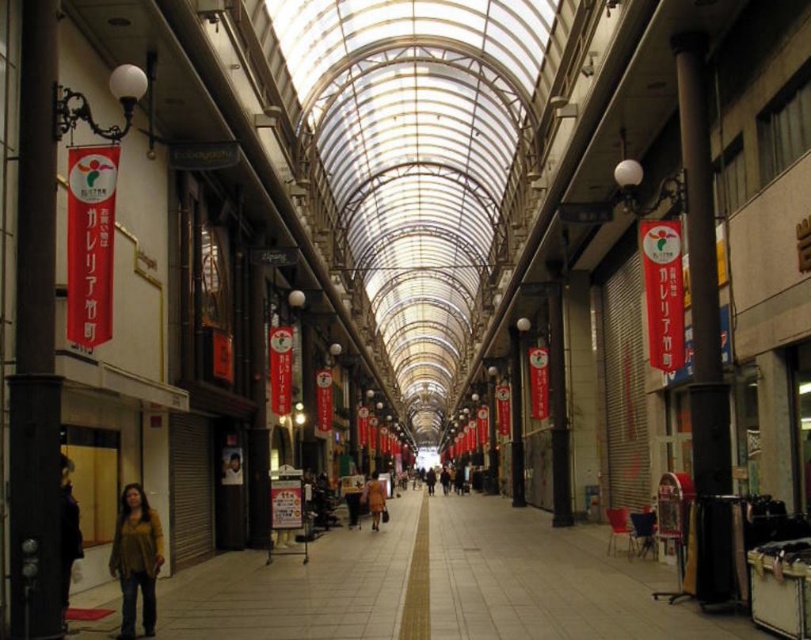
Question: Which of these objects is positioned farthest from the yellow knit sweater at lower left?

Choices:
 (A) dark brown leather jacket at lower left
 (B) black metal pole at right
 (C) orange fabric coat at center

Answer: (C)

Question: Is black metal pole at right to the right of orange fabric coat at center from the viewer's perspective?

Choices:
 (A) yes
 (B) no

Answer: (A)

Question: Observing the image, what is the correct spatial positioning of black metal pole at right in reference to dark brown leather jacket at lower left?

Choices:
 (A) above
 (B) below

Answer: (A)

Question: Is yellow knit sweater at lower left positioned in front of orange fabric coat at center?

Choices:
 (A) yes
 (B) no

Answer: (A)

Question: Among these points, which one is nearest to the camera?

Choices:
 (A) (375, 500)
 (B) (694, 99)
 (C) (71, 520)

Answer: (C)

Question: Which object is positioned farthest from the dark brown leather jacket at lower left?

Choices:
 (A) yellow knit sweater at lower left
 (B) black metal pole at right

Answer: (B)